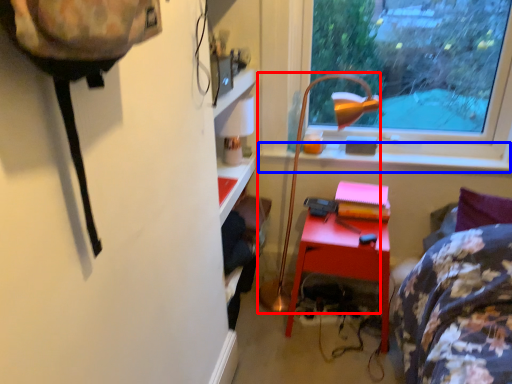
Question: Which object appears closest to the camera in this image, lamp (highlighted by a red box) or window sill (highlighted by a blue box)?

Choices:
 (A) lamp
 (B) window sill

Answer: (A)